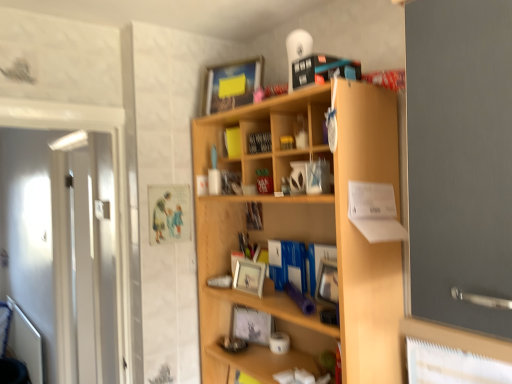
Question: Which direction should I rotate to look at matte silver picture frame at center, placed as the first picture frame when sorted from bottom to top, — up or down?

Choices:
 (A) up
 (B) down

Answer: (B)

Question: Does matte wooden picture frame at upper center, which is counted as the 3th picture frame, starting from the bottom, have a larger size compared to wooden photo frame at center, acting as the 3th book starting from the top?

Choices:
 (A) yes
 (B) no

Answer: (A)

Question: Considering the relative sizes of matte wooden picture frame at upper center, the first picture frame positioned from the top, and wooden photo frame at center, the 1th book positioned from the back, in the image provided, is matte wooden picture frame at upper center, the first picture frame positioned from the top, smaller than wooden photo frame at center, the 1th book positioned from the back,?

Choices:
 (A) yes
 (B) no

Answer: (B)

Question: Is wooden photo frame at center, which is the 1th book in bottom-to-top order, at the back of matte wooden picture frame at upper center, the first picture frame positioned from the top?

Choices:
 (A) no
 (B) yes

Answer: (A)

Question: Is matte wooden picture frame at upper center, the first picture frame positioned from the top, not near wooden photo frame at center, which is the 1th book in bottom-to-top order?

Choices:
 (A) yes
 (B) no

Answer: (B)

Question: Considering the relative sizes of matte wooden picture frame at upper center, which is counted as the 3th picture frame, starting from the bottom, and wooden photo frame at center, acting as the 3th book starting from the front, in the image provided, is matte wooden picture frame at upper center, which is counted as the 3th picture frame, starting from the bottom, wider than wooden photo frame at center, acting as the 3th book starting from the front,?

Choices:
 (A) yes
 (B) no

Answer: (A)

Question: Does matte wooden picture frame at upper center, the first picture frame positioned from the top, have a lesser width compared to wooden photo frame at center, acting as the 3th book starting from the front?

Choices:
 (A) no
 (B) yes

Answer: (A)

Question: Can you confirm if matte wooden picture frame at upper center, the first picture frame positioned from the top, is shorter than light wood shelf at center?

Choices:
 (A) no
 (B) yes

Answer: (B)

Question: Is matte wooden picture frame at upper center, which is counted as the 3th picture frame, starting from the bottom, looking in the opposite direction of light wood shelf at center?

Choices:
 (A) no
 (B) yes

Answer: (A)

Question: Can you confirm if matte wooden picture frame at upper center, the first picture frame positioned from the top, is positioned to the right of light wood shelf at center?

Choices:
 (A) yes
 (B) no

Answer: (B)

Question: From a real-world perspective, does matte wooden picture frame at upper center, which is counted as the 3th picture frame, starting from the bottom, stand above light wood shelf at center?

Choices:
 (A) no
 (B) yes

Answer: (B)

Question: Considering the relative sizes of matte wooden picture frame at upper center, the first picture frame positioned from the top, and light wood shelf at center in the image provided, is matte wooden picture frame at upper center, the first picture frame positioned from the top, smaller than light wood shelf at center?

Choices:
 (A) no
 (B) yes

Answer: (B)

Question: From the image's perspective, is matte wooden picture frame at upper center, the first picture frame positioned from the top, located above light wood shelf at center?

Choices:
 (A) no
 (B) yes

Answer: (B)

Question: Can you confirm if white glossy door at left is bigger than yellow matte book at upper center, which appears as the 2th book when viewed from the back?

Choices:
 (A) no
 (B) yes

Answer: (B)